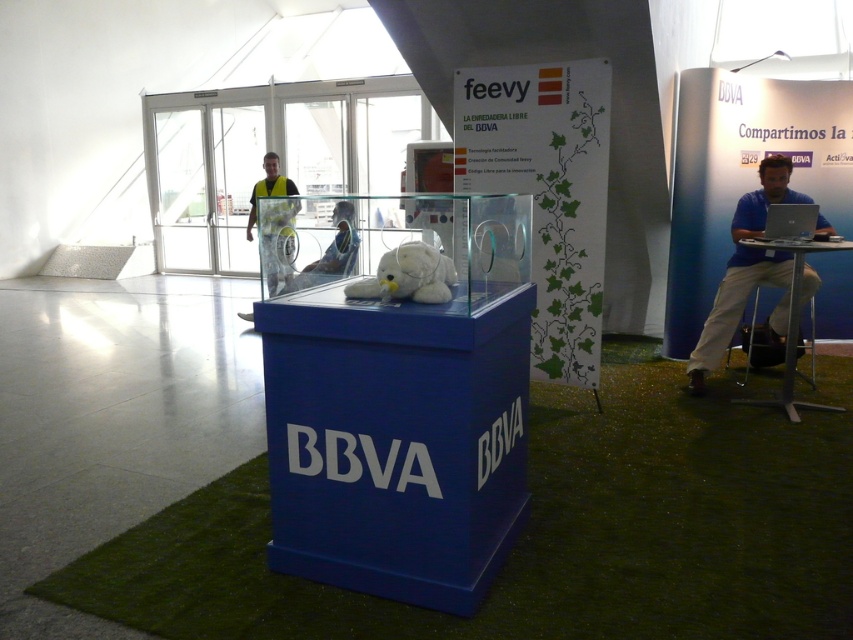
Between point (769, 163) and point (283, 237), which one is positioned behind?

Point (769, 163)

Who is shorter, blue cotton shirt at right or yellow reflective vest at center?

Standing shorter between the two is yellow reflective vest at center.

Image resolution: width=853 pixels, height=640 pixels. What do you see at coordinates (747, 272) in the screenshot?
I see `blue cotton shirt at right` at bounding box center [747, 272].

You are a GUI agent. You are given a task and a screenshot of the screen. Output one action in this format:
    pyautogui.click(x=<x>, y=<y>)
    Task: Click on the blue cotton shirt at right
    
    Given the screenshot: What is the action you would take?
    pyautogui.click(x=747, y=272)

Does yellow reflective vest at center have a greater height compared to white plush at center?

Yes, yellow reflective vest at center is taller than white plush at center.

Which of these two, yellow reflective vest at center or white plush at center, stands shorter?

white plush at center

Find the location of a particular element. yellow reflective vest at center is located at coordinates (274, 224).

Can you confirm if blue cotton shirt at right is bigger than white plush at center?

Yes.

Does point (701, 371) come in front of point (405, 284)?

No, (701, 371) is further to viewer.

At what (x,y) coordinates should I click in order to perform the action: click on blue cotton shirt at right. Please return your answer as a coordinate pair (x, y). This screenshot has width=853, height=640. Looking at the image, I should click on (747, 272).